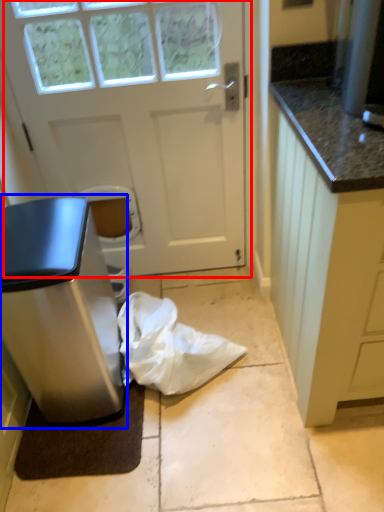
Question: Which of the following is the closest to the observer, door (highlighted by a red box) or home appliance (highlighted by a blue box)?

Choices:
 (A) door
 (B) home appliance

Answer: (B)